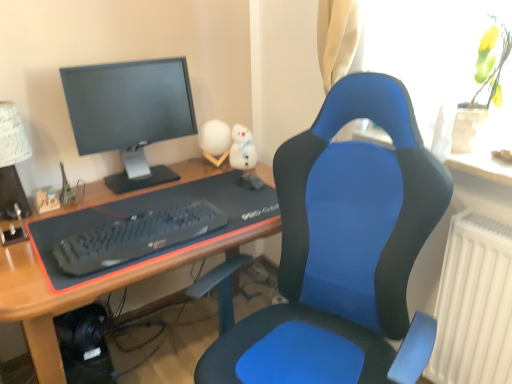
Describe the element at coordinates (85, 291) in the screenshot. I see `blue fabric desk at center` at that location.

What is the approximate width of blue fabric chair at center?

The width of blue fabric chair at center is 26.41 inches.

What do you see at coordinates (130, 114) in the screenshot? This screenshot has height=384, width=512. I see `matte black monitor at upper left` at bounding box center [130, 114].

The height and width of the screenshot is (384, 512). What do you see at coordinates (136, 236) in the screenshot? I see `black matte keyboard at center` at bounding box center [136, 236].

Identify the location of blue fabric desk at center. Image resolution: width=512 pixels, height=384 pixels. (85, 291).

Is point (25, 296) behind point (111, 100)?

No.

The width and height of the screenshot is (512, 384). Identify the location of computer monitor above the blue fabric desk at center (from a real-world perspective). (130, 114).

Is blue fabric desk at center completely or partially outside of matte black monitor at upper left?

Yes.

From the picture: Which of these two, blue fabric desk at center or matte black monitor at upper left, is thinner?

With smaller width is matte black monitor at upper left.

Is transparent glass vase at upper right inside the boundaries of black matte keyboard at center, or outside?

transparent glass vase at upper right is not inside black matte keyboard at center, it's outside.

Who is more distant, transparent glass vase at upper right or black matte keyboard at center?

Positioned behind is black matte keyboard at center.

Is transparent glass vase at upper right not close to black matte keyboard at center?

That's not correct — transparent glass vase at upper right is a little close to black matte keyboard at center.

Based on their positions, is blue fabric desk at center located to the left or right of transparent glass vase at upper right?

From the image, it's evident that blue fabric desk at center is to the left of transparent glass vase at upper right.

Which is in front, point (34, 340) or point (366, 59)?

The point (34, 340) is more forward.

Could you tell me if blue fabric desk at center is turned towards transparent glass vase at upper right?

No, blue fabric desk at center is not facing towards transparent glass vase at upper right.

Based on the photo, does blue fabric desk at center appear on the right side of white paper lampshade at upper left?

Yes.

Looking at their sizes, would you say blue fabric desk at center is wider or thinner than white paper lampshade at upper left?

Clearly, blue fabric desk at center has more width compared to white paper lampshade at upper left.

From the image's perspective, is blue fabric desk at center above or below white paper lampshade at upper left?

blue fabric desk at center is situated lower than white paper lampshade at upper left in the image.

Is black matte keyboard at center wider or thinner than transparent glass vase at upper right?

Considering their sizes, black matte keyboard at center looks slimmer than transparent glass vase at upper right.

Can we say black matte keyboard at center lies outside transparent glass vase at upper right?

Indeed, black matte keyboard at center is completely outside transparent glass vase at upper right.

Which point is more distant from viewer, (161, 234) or (464, 87)?

Point (161, 234)

In the image, there is a blue fabric chair at center. Identify the location of computer monitor above it (from the image's perspective). (130, 114).

Considering the points (90, 144) and (325, 244), which point is behind, point (90, 144) or point (325, 244)?

The point (90, 144) is farther.

Would you consider matte black monitor at upper left to be distant from blue fabric chair at center?

No.

What's the angular difference between matte black monitor at upper left and blue fabric chair at center's facing directions?

matte black monitor at upper left and blue fabric chair at center are facing 64.8 degrees away from each other.

Is blue fabric chair at center turned away from black matte keyboard at center?

No, black matte keyboard at center is not at the back of blue fabric chair at center.

Does point (362, 237) come behind point (120, 258)?

Yes, it is.

Which of these two, blue fabric chair at center or black matte keyboard at center, is bigger?

blue fabric chair at center is bigger.

This screenshot has width=512, height=384. What are the coordinates of `chair below the black matte keyboard at center (from the image's perspective)` in the screenshot? It's located at (341, 246).

Identify the location of desk in front of the matte black monitor at upper left. The height and width of the screenshot is (384, 512). (85, 291).

You are a GUI agent. You are given a task and a screenshot of the screen. Output one action in this format:
    pyautogui.click(x=<x>, y=<y>)
    Task: Click on the computer keyboard below the transparent glass vase at upper right (from the image's perspective)
    This screenshot has width=512, height=384.
    Given the screenshot: What is the action you would take?
    pyautogui.click(x=136, y=236)

Considering their positions, is white paper lampshade at upper left positioned closer to black matte keyboard at center than matte black monitor at upper left?

Among the two, matte black monitor at upper left is located nearer to black matte keyboard at center.

Looking at the image, which one is located closer to blue fabric desk at center, blue fabric chair at center or matte black monitor at upper left?

Based on the image, matte black monitor at upper left appears to be nearer to blue fabric desk at center.

Consider the image. Looking at the image, which one is located closer to matte black monitor at upper left, blue fabric chair at center or transparent glass vase at upper right?

blue fabric chair at center.

Looking at the image, which one is located closer to black matte keyboard at center, blue fabric desk at center or white paper lampshade at upper left?

Based on the image, blue fabric desk at center appears to be nearer to black matte keyboard at center.

When comparing their distances from blue fabric desk at center, does white paper lampshade at upper left or black matte keyboard at center seem closer?

Among the two, black matte keyboard at center is located nearer to blue fabric desk at center.

Considering their positions, is blue fabric chair at center positioned closer to blue fabric desk at center than white paper lampshade at upper left?

blue fabric chair at center is closer to blue fabric desk at center.

Which object lies nearer to the anchor point white paper lampshade at upper left, blue fabric desk at center or blue fabric chair at center?

The object closer to white paper lampshade at upper left is blue fabric desk at center.

Estimate the real-world distances between objects in this image. Which object is further from matte black monitor at upper left, blue fabric desk at center or black matte keyboard at center?

black matte keyboard at center.

Image resolution: width=512 pixels, height=384 pixels. In order to click on chair located between black matte keyboard at center and transparent glass vase at upper right in the left-right direction in this screenshot , I will do `click(341, 246)`.

Find the location of a particular element. This screenshot has height=384, width=512. computer keyboard that lies between matte black monitor at upper left and blue fabric desk at center from top to bottom is located at coordinates (136, 236).

I want to click on computer keyboard between white paper lampshade at upper left and transparent glass vase at upper right from left to right, so click(x=136, y=236).

In order to click on desk between matte black monitor at upper left and transparent glass vase at upper right from left to right in this screenshot , I will do `click(85, 291)`.